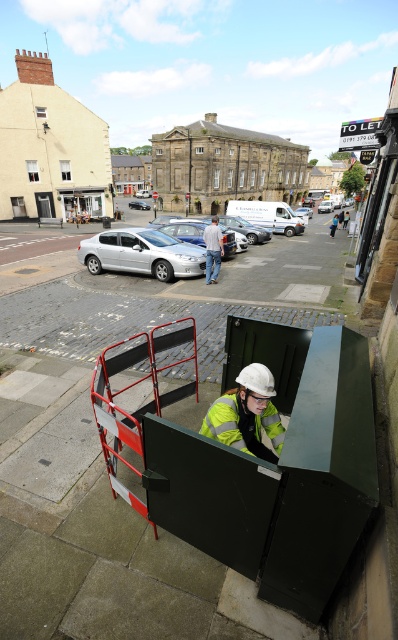
Question: Is metallic red barricade at center in front of silver metallic car at center?

Choices:
 (A) no
 (B) yes

Answer: (B)

Question: Which point is farther from the camera taking this photo?

Choices:
 (A) (132, 204)
 (B) (267, 410)
 (C) (193, 262)

Answer: (A)

Question: Estimate the real-world distances between objects in this image. Which object is closer to the silver metallic car at center?

Choices:
 (A) silver metallic car at center-left
 (B) denim jeans at center
 (C) green matte construction platform at center
 (D) metallic red barricade at center

Answer: (C)

Question: Can you confirm if silver metallic car at center-left is positioned below denim jeans at center?

Choices:
 (A) no
 (B) yes

Answer: (B)

Question: Which point is closer to the camera taking this photo?

Choices:
 (A) (113, 364)
 (B) (191, 572)
 (C) (152, 250)
 (D) (144, 208)

Answer: (B)

Question: Does green matte construction platform at center appear over silver metallic car at center?

Choices:
 (A) no
 (B) yes

Answer: (A)